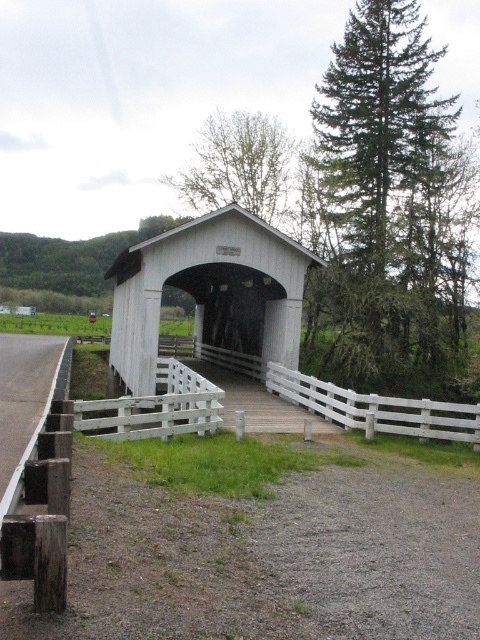
Does white wooden bridge at center come in front of smooth asphalt road at lower left?

No, it is behind smooth asphalt road at lower left.

How much distance is there between white wooden bridge at center and smooth asphalt road at lower left?

6.45 meters

Between point (120, 264) and point (36, 429), which one is positioned in front?

Point (36, 429) is more forward.

Locate an element on the screen. This screenshot has height=640, width=480. white wooden bridge at center is located at coordinates tap(211, 291).